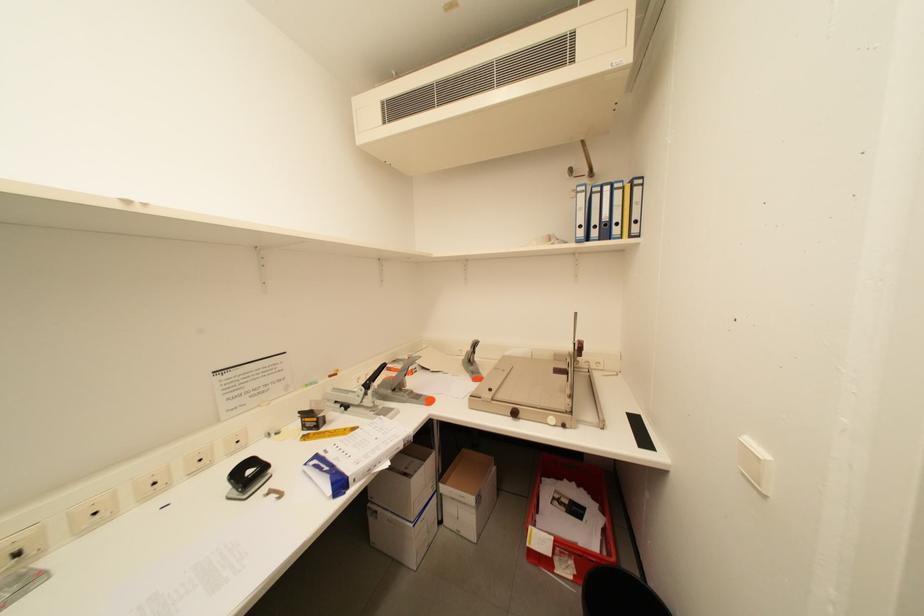
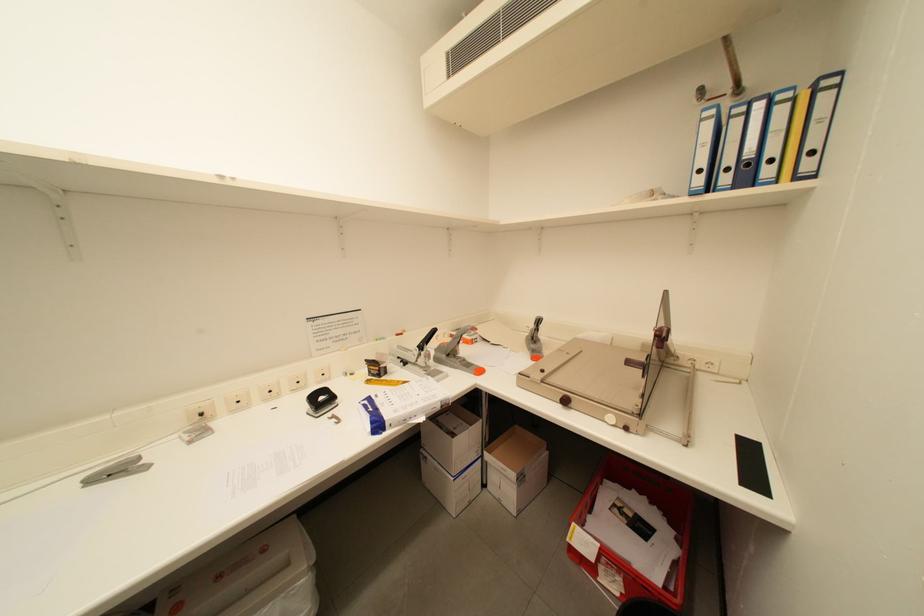
Question: Based on the continuous images, in which direction is the camera rotating? Reply with the corresponding letter.

Choices:
 (A) Left
 (B) Right
 (C) Up
 (D) Down

Answer: (A)